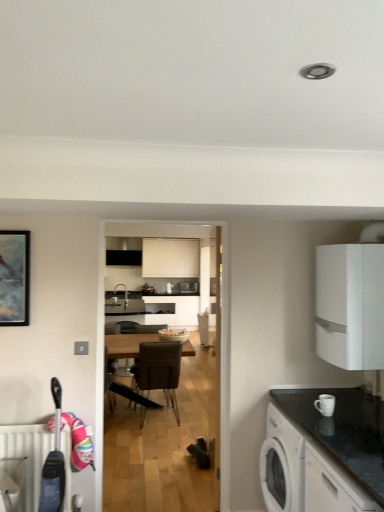
Question: Can matte white bowl at center be found inside white matte cabinet at lower right, marked as the second cabinetry in a top-to-bottom arrangement?

Choices:
 (A) yes
 (B) no

Answer: (B)

Question: Can you confirm if white matte cabinet at lower right, placed as the 1th cabinetry when sorted from front to back, is taller than matte white bowl at center?

Choices:
 (A) yes
 (B) no

Answer: (A)

Question: Does white matte cabinet at lower right, marked as the second cabinetry in a top-to-bottom arrangement, have a smaller size compared to matte white bowl at center?

Choices:
 (A) no
 (B) yes

Answer: (A)

Question: From the image's perspective, does white matte cabinet at lower right, placed as the 1th cabinetry when sorted from front to back, appear lower than matte white bowl at center?

Choices:
 (A) no
 (B) yes

Answer: (B)

Question: From a real-world perspective, is white matte cabinet at lower right, the 1th cabinetry in the bottom-to-top sequence, positioned under matte white bowl at center based on gravity?

Choices:
 (A) no
 (B) yes

Answer: (B)

Question: Can you confirm if white matte cabinet at lower right, marked as the second cabinetry in a top-to-bottom arrangement, is positioned to the right of matte white bowl at center?

Choices:
 (A) yes
 (B) no

Answer: (A)

Question: Is white matte cabinet at lower right, marked as the second cabinetry in a top-to-bottom arrangement, inside white textured radiator at lower left?

Choices:
 (A) yes
 (B) no

Answer: (B)

Question: Considering the relative sizes of white textured radiator at lower left and white matte cabinet at lower right, placed as the 2th cabinetry when sorted from back to front, in the image provided, is white textured radiator at lower left wider than white matte cabinet at lower right, placed as the 2th cabinetry when sorted from back to front,?

Choices:
 (A) yes
 (B) no

Answer: (B)

Question: Are white textured radiator at lower left and white matte cabinet at lower right, the 1th cabinetry in the bottom-to-top sequence, beside each other?

Choices:
 (A) yes
 (B) no

Answer: (B)

Question: Is white textured radiator at lower left behind white matte cabinet at lower right, placed as the 2th cabinetry when sorted from back to front?

Choices:
 (A) yes
 (B) no

Answer: (A)

Question: From the image's perspective, is white textured radiator at lower left on top of white matte cabinet at lower right, placed as the 2th cabinetry when sorted from back to front?

Choices:
 (A) no
 (B) yes

Answer: (A)

Question: From a real-world perspective, is white textured radiator at lower left located beneath white matte cabinet at lower right, placed as the 1th cabinetry when sorted from front to back?

Choices:
 (A) yes
 (B) no

Answer: (A)

Question: Is white matte cabinet at lower right, placed as the 2th cabinetry when sorted from back to front, outside brown leather chair at center?

Choices:
 (A) no
 (B) yes

Answer: (B)